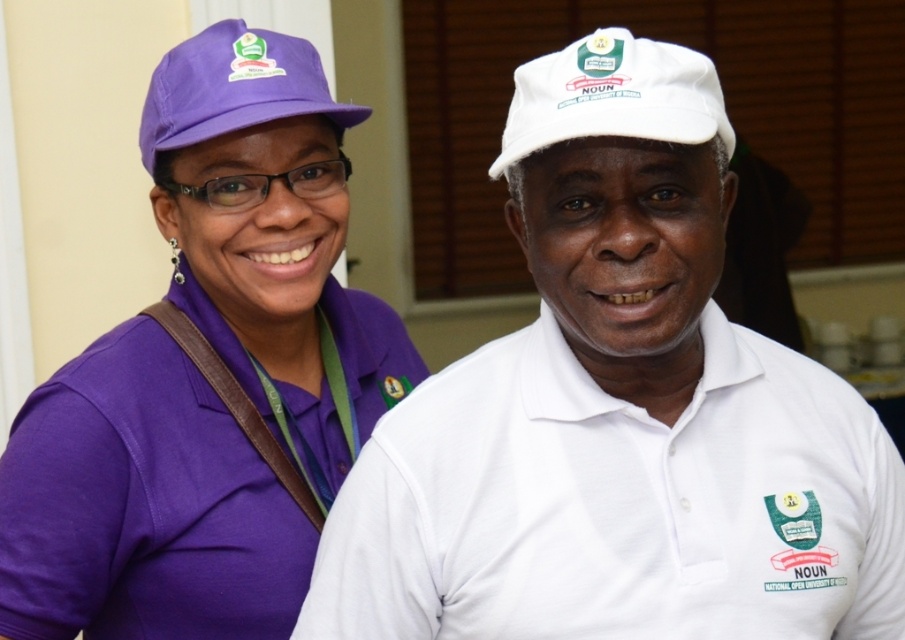
Question: From the image, what is the correct spatial relationship of matte purple cap at upper left in relation to white matte baseball cap at upper center?

Choices:
 (A) left
 (B) right

Answer: (A)

Question: Can you confirm if matte purple cap at upper left is positioned below matte purple baseball cap at upper left?

Choices:
 (A) yes
 (B) no

Answer: (A)

Question: Which point is farther to the camera?

Choices:
 (A) (511, 186)
 (B) (382, 352)
 (C) (632, 52)
 (D) (150, 145)

Answer: (B)

Question: Is white matte cap at upper center wider than matte purple baseball cap at upper left?

Choices:
 (A) no
 (B) yes

Answer: (B)

Question: Which is nearer to the white matte cap at upper center?

Choices:
 (A) matte purple baseball cap at upper left
 (B) matte purple cap at upper left
 (C) white matte baseball cap at upper center

Answer: (C)

Question: Which point is closer to the camera taking this photo?

Choices:
 (A) (139, 140)
 (B) (684, 120)
 (C) (505, 170)
 (D) (319, 419)

Answer: (B)